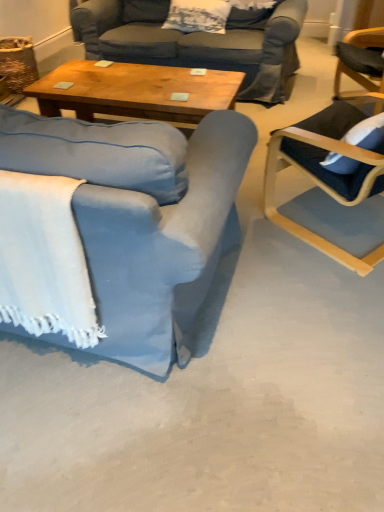
Question: Is blue fabric chair at left, marked as the 1th chair in a left-to-right arrangement, further to camera compared to white textured pillow at upper center?

Choices:
 (A) yes
 (B) no

Answer: (B)

Question: Does blue fabric chair at left, which is the 2th chair from right to left, appear on the right side of white textured pillow at upper center?

Choices:
 (A) yes
 (B) no

Answer: (B)

Question: From the image's perspective, would you say blue fabric chair at left, which is the 2th chair from right to left, is shown under white textured pillow at upper center?

Choices:
 (A) yes
 (B) no

Answer: (A)

Question: Is blue fabric chair at left, which is the 2th chair from right to left, shorter than white textured pillow at upper center?

Choices:
 (A) yes
 (B) no

Answer: (B)

Question: From the image's perspective, is blue fabric chair at left, marked as the 1th chair in a left-to-right arrangement, above white textured pillow at upper center?

Choices:
 (A) no
 (B) yes

Answer: (A)

Question: From the image's perspective, is white textured pillow at upper center above or below wooden coffee table at center?

Choices:
 (A) below
 (B) above

Answer: (B)

Question: Considering the positions of white textured pillow at upper center and wooden coffee table at center in the image, is white textured pillow at upper center bigger or smaller than wooden coffee table at center?

Choices:
 (A) big
 (B) small

Answer: (B)

Question: From a real-world perspective, is white textured pillow at upper center physically located above or below wooden coffee table at center?

Choices:
 (A) below
 (B) above

Answer: (B)

Question: From their relative heights in the image, would you say white textured pillow at upper center is taller or shorter than wooden coffee table at center?

Choices:
 (A) short
 (B) tall

Answer: (A)

Question: Considering the positions of white woven blanket at lower left and blue fabric chair at left, which is the 2th chair from right to left, in the image, is white woven blanket at lower left bigger or smaller than blue fabric chair at left, which is the 2th chair from right to left,?

Choices:
 (A) big
 (B) small

Answer: (B)

Question: Based on their positions, is white woven blanket at lower left located to the left or right of blue fabric chair at left, marked as the 1th chair in a left-to-right arrangement?

Choices:
 (A) left
 (B) right

Answer: (B)

Question: Would you say white woven blanket at lower left is inside or outside blue fabric chair at left, which is the 2th chair from right to left?

Choices:
 (A) inside
 (B) outside

Answer: (A)

Question: Is white woven blanket at lower left wider or thinner than blue fabric chair at left, marked as the 1th chair in a left-to-right arrangement?

Choices:
 (A) thin
 (B) wide

Answer: (A)

Question: From a real-world perspective, relative to white textured pillow at upper center, is blue fabric chair at left, which is the 2th chair from right to left, vertically above or below?

Choices:
 (A) above
 (B) below

Answer: (B)

Question: Looking at their shapes, would you say blue fabric chair at left, marked as the 1th chair in a left-to-right arrangement, is wider or thinner than white textured pillow at upper center?

Choices:
 (A) thin
 (B) wide

Answer: (B)